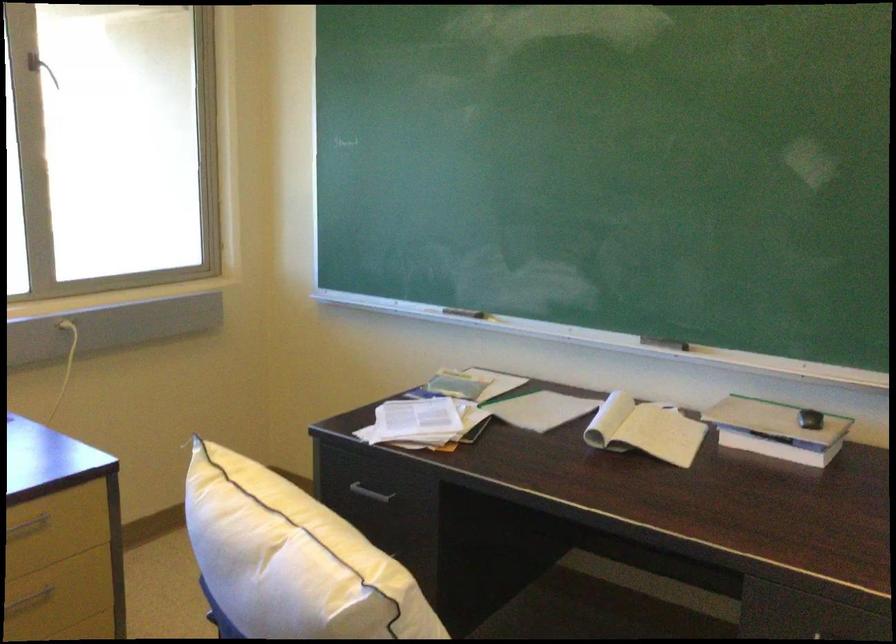
Where is `drawer handle`? The image size is (896, 644). drawer handle is located at coordinates (30, 599).